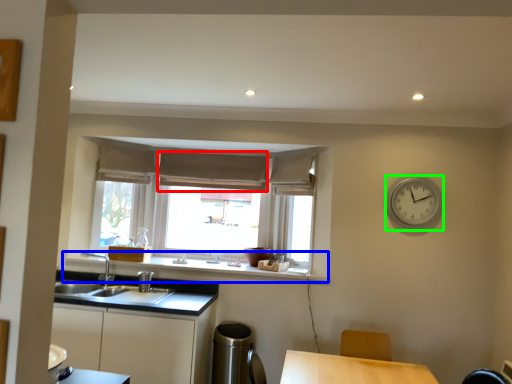
Question: Considering the real-world distances, which object is closest to curtain (highlighted by a red box)? window sill (highlighted by a blue box) or clock (highlighted by a green box).

Choices:
 (A) window sill
 (B) clock

Answer: (A)